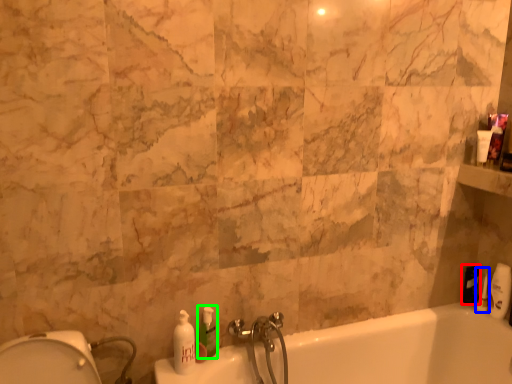
Question: Which is farther away from toiletry (highlighted by a red box)? toiletry (highlighted by a blue box) or soap dispenser (highlighted by a green box)?

Choices:
 (A) toiletry
 (B) soap dispenser

Answer: (B)